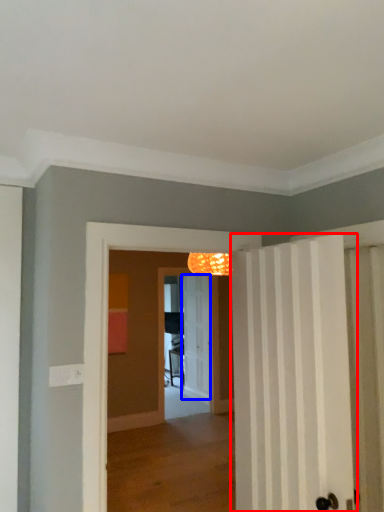
Question: Among these objects, which one is farthest to the camera, door (highlighted by a red box) or door (highlighted by a blue box)?

Choices:
 (A) door
 (B) door

Answer: (B)